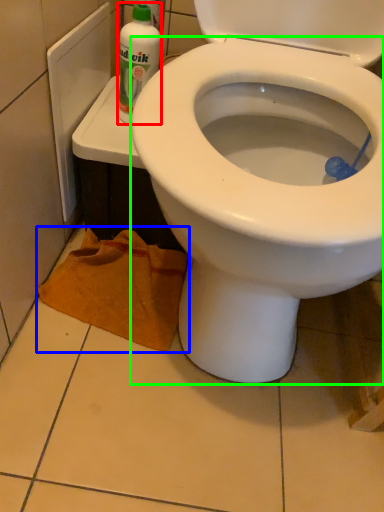
Question: Which object is the farthest from cleaning product (highlighted by a red box)? Choose among these: material (highlighted by a blue box) or bidet (highlighted by a green box).

Choices:
 (A) material
 (B) bidet

Answer: (B)